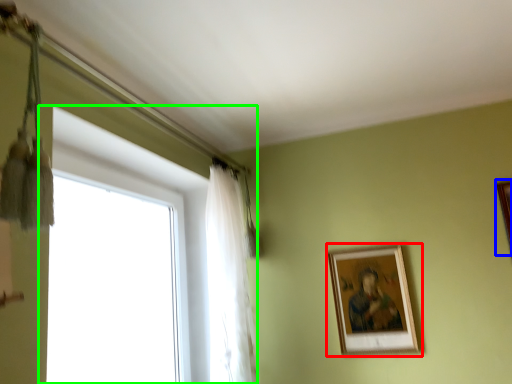
Question: Estimate the real-world distances between objects in this image. Which object is closer to picture frame (highlighted by a red box), picture frame (highlighted by a blue box) or window (highlighted by a green box)?

Choices:
 (A) picture frame
 (B) window

Answer: (A)